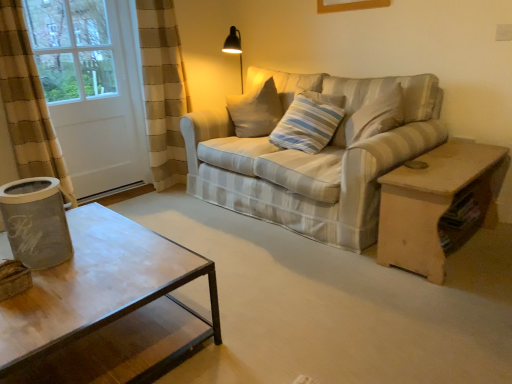
Identify the location of light brown wooden table at right. (432, 203).

Describe the element at coordinates (309, 122) in the screenshot. I see `striped fabric pillow at center` at that location.

What do you see at coordinates (92, 91) in the screenshot? The width and height of the screenshot is (512, 384). I see `white matte screen door at left` at bounding box center [92, 91].

Find the location of `light brown wooden table at right`. light brown wooden table at right is located at coordinates (432, 203).

Would you say striped fabric pillow at center is inside or outside light brown wooden table at right?

striped fabric pillow at center lies outside light brown wooden table at right.

Based on their sizes in the image, would you say striped fabric pillow at center is bigger or smaller than light brown wooden table at right?

Clearly, striped fabric pillow at center is smaller in size than light brown wooden table at right.

Is striped fabric pillow at center wider or thinner than light brown wooden table at right?

Considering their sizes, striped fabric pillow at center looks slimmer than light brown wooden table at right.

From a real-world perspective, is striped fabric pillow at center positioned over light brown wooden table at right based on gravity?

Indeed, from a real-world perspective, striped fabric pillow at center stands above light brown wooden table at right.

From the image's perspective, which is above, light brown wooden table at right or striped fabric couch at center?

→ striped fabric couch at center, from the image's perspective.

Locate an element on the screen. studio couch above the light brown wooden table at right (from the image's perspective) is located at coordinates (314, 154).

Could you tell me if light brown wooden table at right is facing striped fabric couch at center?

No, light brown wooden table at right is not oriented towards striped fabric couch at center.

Does point (489, 162) come behind point (243, 169)?

No, (489, 162) is closer to viewer.

Consider the image. Is white matte screen door at left bigger or smaller than striped fabric pillow at center?

In the image, white matte screen door at left appears to be larger than striped fabric pillow at center.

Is white matte screen door at left not within striped fabric pillow at center?

Absolutely, white matte screen door at left is external to striped fabric pillow at center.

In terms of height, does white matte screen door at left look taller or shorter compared to striped fabric pillow at center?

In the image, white matte screen door at left appears to be taller than striped fabric pillow at center.

Is point (429, 202) behind point (106, 36)?

No, it is in front of (106, 36).

Can you confirm if light brown wooden table at right is shorter than white matte screen door at left?

Indeed, light brown wooden table at right has a lesser height compared to white matte screen door at left.

Is light brown wooden table at right to the left of white matte screen door at left from the viewer's perspective?

No.

From the picture: Is striped fabric pillow at center inside the boundaries of striped fabric couch at center, or outside?

striped fabric pillow at center exists entirely within striped fabric couch at center.

How far apart are striped fabric pillow at center and striped fabric couch at center?

They are 11.74 inches apart.

Is striped fabric pillow at center shorter than striped fabric couch at center?

Yes, striped fabric pillow at center is shorter than striped fabric couch at center.

Do you think striped fabric pillow at center is within white matte screen door at left, or outside of it?

striped fabric pillow at center exists outside the volume of white matte screen door at left.

You are a GUI agent. You are given a task and a screenshot of the screen. Output one action in this format:
    pyautogui.click(x=<x>, y=<y>)
    Task: Click on the pillow located below the white matte screen door at left (from the image's perspective)
    This screenshot has width=512, height=384.
    Given the screenshot: What is the action you would take?
    pyautogui.click(x=309, y=122)

Is striped fabric pillow at center oriented towards white matte screen door at left?

No, striped fabric pillow at center is not aimed at white matte screen door at left.

Considering the points (296, 110) and (63, 99), which point is in front, point (296, 110) or point (63, 99)?

The point (296, 110) is more forward.

Which is more to the left, striped fabric couch at center or striped fabric pillow at center?

striped fabric couch at center is more to the left.

Does striped fabric couch at center turn towards striped fabric pillow at center?

Yes, striped fabric couch at center is oriented towards striped fabric pillow at center.

Is point (417, 86) less distant than point (302, 129)?

Yes, it is in front of point (302, 129).

Is striped fabric couch at center beside striped fabric pillow at center?

No, striped fabric couch at center is not with striped fabric pillow at center.

You are a GUI agent. You are given a task and a screenshot of the screen. Output one action in this format:
    pyautogui.click(x=<x>, y=<y>)
    Task: Click on the pillow on the left of the light brown wooden table at right
    Image resolution: width=512 pixels, height=384 pixels.
    Given the screenshot: What is the action you would take?
    pyautogui.click(x=309, y=122)

The image size is (512, 384). Identify the location of studio couch above the light brown wooden table at right (from the image's perspective). (314, 154).

Which object lies nearer to the anchor point striped fabric couch at center, light brown wooden table at right or striped fabric pillow at center?

Based on the image, striped fabric pillow at center appears to be nearer to striped fabric couch at center.

From the image, which object appears to be farther from striped fabric couch at center, white matte screen door at left or striped fabric pillow at center?

white matte screen door at left is further to striped fabric couch at center.

From the picture: Considering their positions, is light brown wooden table at right positioned closer to white matte screen door at left than striped fabric couch at center?

The object closer to white matte screen door at left is striped fabric couch at center.

When comparing their distances from striped fabric pillow at center, does white matte screen door at left or light brown wooden table at right seem closer?

light brown wooden table at right lies closer to striped fabric pillow at center than the other object.

Considering their positions, is striped fabric pillow at center positioned further to light brown wooden table at right than striped fabric couch at center?

Based on the image, striped fabric pillow at center appears to be further to light brown wooden table at right.

From the image, which object appears to be nearer to white matte screen door at left, striped fabric couch at center or striped fabric pillow at center?

striped fabric couch at center is closer to white matte screen door at left.

When comparing their distances from striped fabric pillow at center, does light brown wooden table at right or white matte screen door at left seem further?

Based on the image, white matte screen door at left appears to be further to striped fabric pillow at center.

Estimate the real-world distances between objects in this image. Which object is closer to light brown wooden table at right, striped fabric couch at center or white matte screen door at left?

striped fabric couch at center is closer to light brown wooden table at right.

Image resolution: width=512 pixels, height=384 pixels. Identify the location of pillow between white matte screen door at left and light brown wooden table at right from left to right. (309, 122).

The image size is (512, 384). I want to click on studio couch between white matte screen door at left and striped fabric pillow at center from left to right, so click(x=314, y=154).

At what (x,y) coordinates should I click in order to perform the action: click on studio couch located between light brown wooden table at right and striped fabric pillow at center in the depth direction. Please return your answer as a coordinate pair (x, y). Looking at the image, I should click on (314, 154).

Identify the location of studio couch between white matte screen door at left and light brown wooden table at right in the horizontal direction. This screenshot has height=384, width=512. (314, 154).